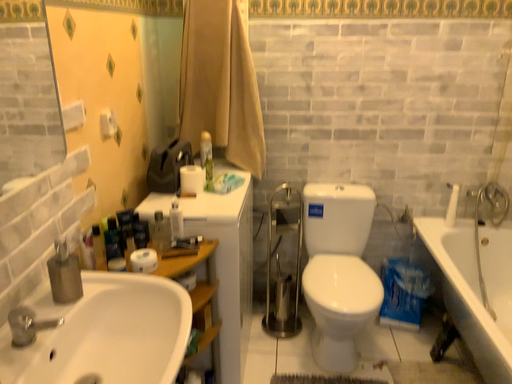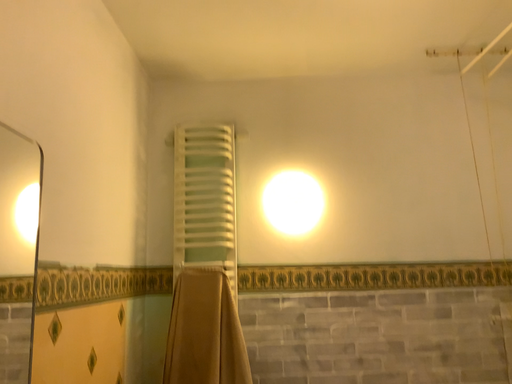
Question: Which way did the camera rotate in the video?

Choices:
 (A) rotated upward
 (B) rotated downward

Answer: (A)